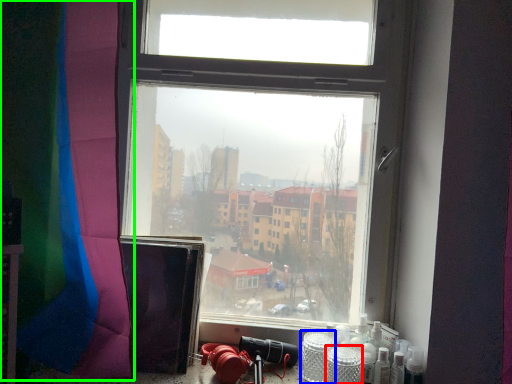
Question: Which object is the closest to the glass jar (highlighted by a red box)? Choose among these: glass jar (highlighted by a blue box) or curtain (highlighted by a green box).

Choices:
 (A) glass jar
 (B) curtain

Answer: (A)